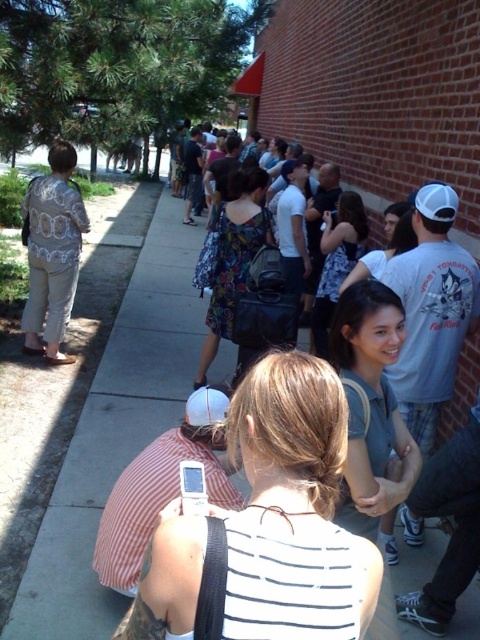
Question: Which point is closer to the camera?

Choices:
 (A) white striped shirt at center
 (B) light beige fabric dress at left

Answer: (A)

Question: Is white striped shirt at center positioned before light beige fabric dress at left?

Choices:
 (A) no
 (B) yes

Answer: (B)

Question: Among these objects, which one is nearest to the camera?

Choices:
 (A) light beige fabric dress at left
 (B) white striped shirt at center

Answer: (B)

Question: Considering the relative positions of white striped shirt at center and light beige fabric dress at left in the image provided, where is white striped shirt at center located with respect to light beige fabric dress at left?

Choices:
 (A) right
 (B) left

Answer: (A)

Question: Is white striped shirt at center to the left of light beige fabric dress at left from the viewer's perspective?

Choices:
 (A) yes
 (B) no

Answer: (B)